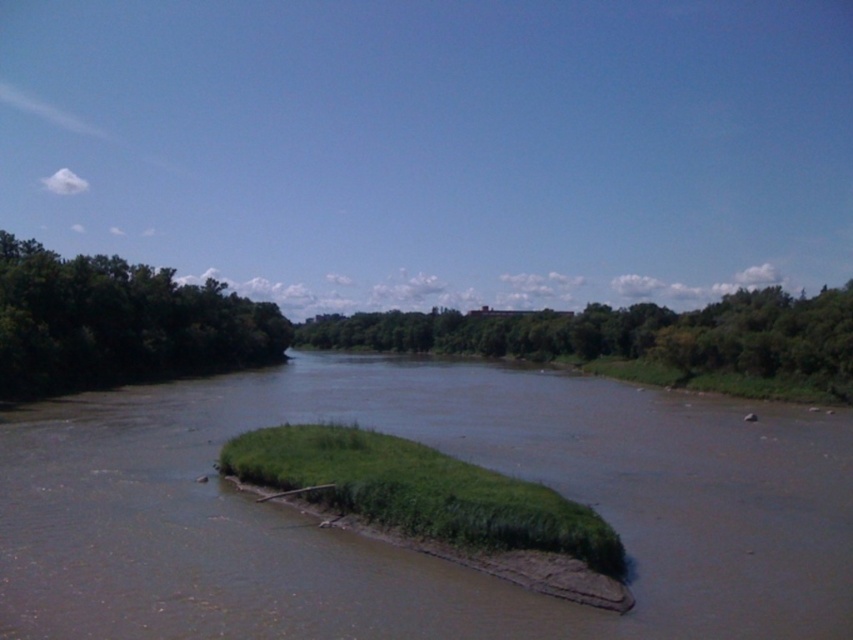
Between point (821, 310) and point (563, 550), which one is positioned behind?

The point (821, 310) is behind.

Is point (300, 326) more distant than point (486, 499)?

That is True.

Between point (515, 312) and point (445, 464), which one is positioned behind?

Positioned behind is point (515, 312).

Where is `green leafy trees at center`? This screenshot has height=640, width=853. green leafy trees at center is located at coordinates (637, 340).

How far apart are green leafy trees at center and green leafy trees at left?

They are 237.82 feet apart.

Who is more distant from viewer, (735, 332) or (144, 320)?

The point (144, 320) is behind.

Identify the location of green leafy trees at center. The height and width of the screenshot is (640, 853). (637, 340).

Is brown muddy river at center taller than green leafy trees at left?

No, brown muddy river at center is not taller than green leafy trees at left.

This screenshot has height=640, width=853. I want to click on brown muddy river at center, so click(x=405, y=550).